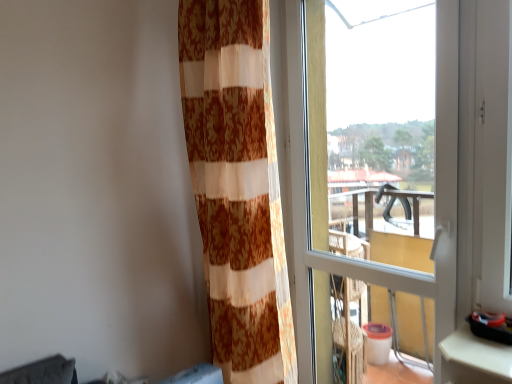
Question: Could you tell me if transparent glass window at right is turned towards orange floral sheer curtain at center?

Choices:
 (A) no
 (B) yes

Answer: (B)

Question: Is the position of transparent glass window at right less distant than that of orange floral sheer curtain at center?

Choices:
 (A) no
 (B) yes

Answer: (B)

Question: Is transparent glass window at right positioned behind orange floral sheer curtain at center?

Choices:
 (A) yes
 (B) no

Answer: (B)

Question: Can you confirm if transparent glass window at right is taller than orange floral sheer curtain at center?

Choices:
 (A) yes
 (B) no

Answer: (A)

Question: Would you say transparent glass window at right is outside orange floral sheer curtain at center?

Choices:
 (A) no
 (B) yes

Answer: (B)

Question: Is transparent glass window at right oriented away from orange floral sheer curtain at center?

Choices:
 (A) yes
 (B) no

Answer: (A)

Question: Is the surface of orange floral sheer curtain at center in direct contact with transparent glass window at right?

Choices:
 (A) no
 (B) yes

Answer: (A)

Question: Can you confirm if orange floral sheer curtain at center is wider than transparent glass window at right?

Choices:
 (A) no
 (B) yes

Answer: (B)

Question: Would you say orange floral sheer curtain at center is outside transparent glass window at right?

Choices:
 (A) yes
 (B) no

Answer: (A)

Question: Would you say orange floral sheer curtain at center is a long distance from transparent glass window at right?

Choices:
 (A) no
 (B) yes

Answer: (A)

Question: From a real-world perspective, is orange floral sheer curtain at center positioned under transparent glass window at right based on gravity?

Choices:
 (A) yes
 (B) no

Answer: (B)

Question: From the image's perspective, is orange floral sheer curtain at center on top of transparent glass window at right?

Choices:
 (A) yes
 (B) no

Answer: (A)

Question: Is orange floral sheer curtain at center inside or outside of transparent glass window at right?

Choices:
 (A) outside
 (B) inside

Answer: (A)